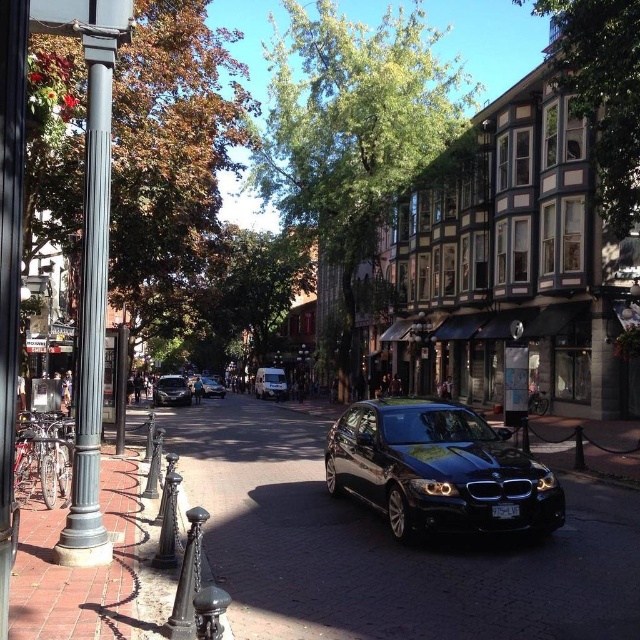
Question: Is the position of brick pavement at center more distant than that of shiny silver sedan at center?

Choices:
 (A) no
 (B) yes

Answer: (A)

Question: Which object is the closest to the black glass lamp post at center?

Choices:
 (A) brick pavement at center
 (B) shiny silver sedan at center

Answer: (A)

Question: Estimate the real-world distances between objects in this image. Which object is farther from the brick pavement at center?

Choices:
 (A) glossy black car at center
 (B) black glass lamp post at center
 (C) shiny silver sedan at center
 (D) polished metal streetlamp at center

Answer: (C)

Question: Which object appears farthest from the camera in this image?

Choices:
 (A) shiny silver sedan at center
 (B) brick pavement at center
 (C) black glass lamp post at center

Answer: (A)

Question: Where is shiny black sedan at center located in relation to shiny silver sedan at center in the image?

Choices:
 (A) below
 (B) above

Answer: (B)

Question: Does glossy black car at center lie in front of shiny silver sedan at center?

Choices:
 (A) yes
 (B) no

Answer: (A)